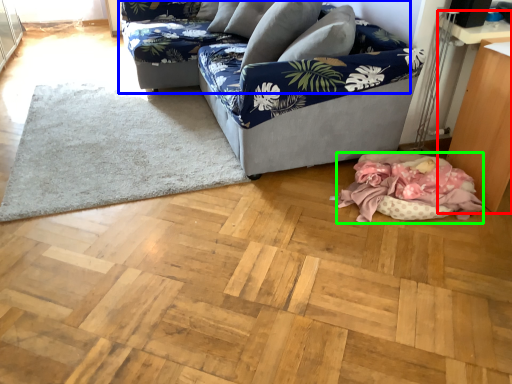
Question: Estimate the real-world distances between objects in this image. Which object is closer to table (highlighted by a red box), studio couch (highlighted by a blue box) or blanket (highlighted by a green box)?

Choices:
 (A) studio couch
 (B) blanket

Answer: (B)